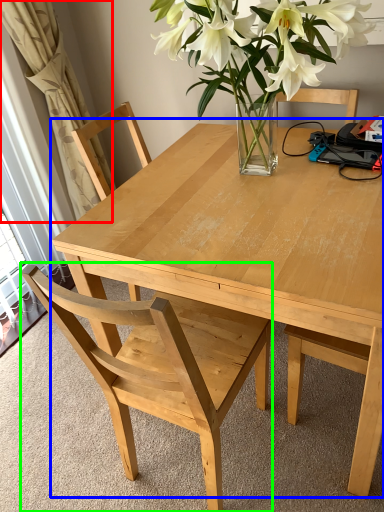
Question: Which is nearer to the curtain (highlighted by a red box)? kitchen & dining room table (highlighted by a blue box) or chair (highlighted by a green box).

Choices:
 (A) kitchen & dining room table
 (B) chair

Answer: (A)